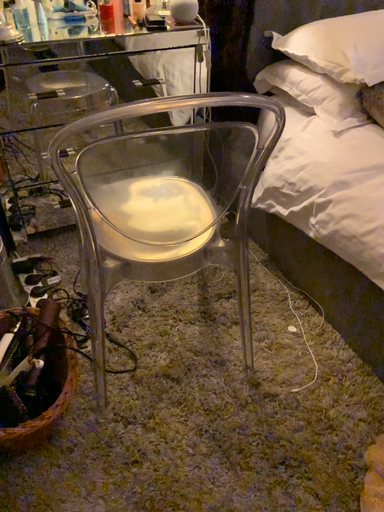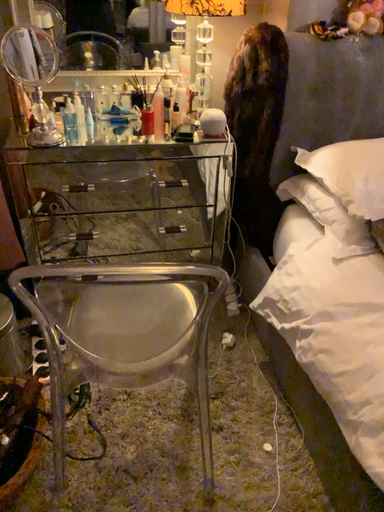
Question: How did the camera likely rotate when shooting the video?

Choices:
 (A) rotated right
 (B) rotated left

Answer: (B)